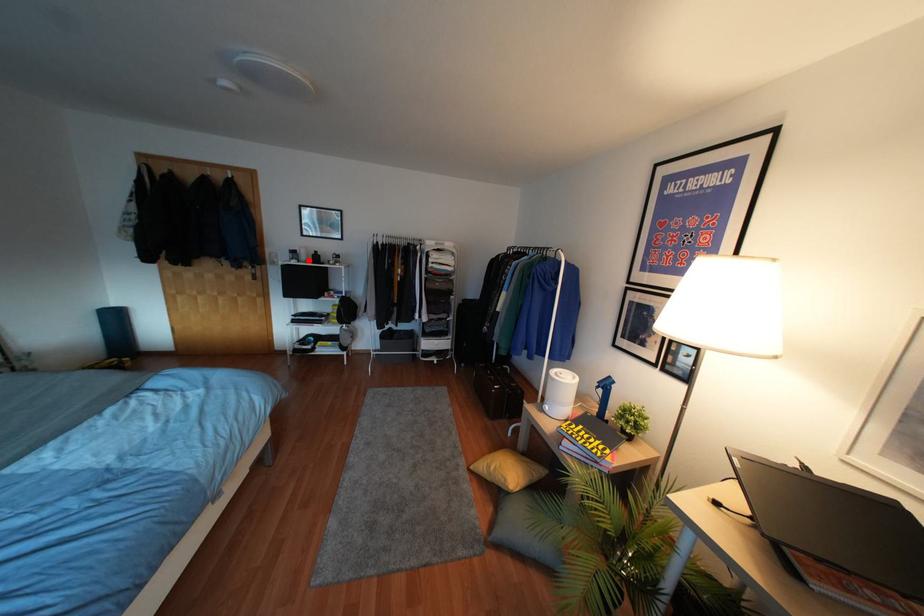
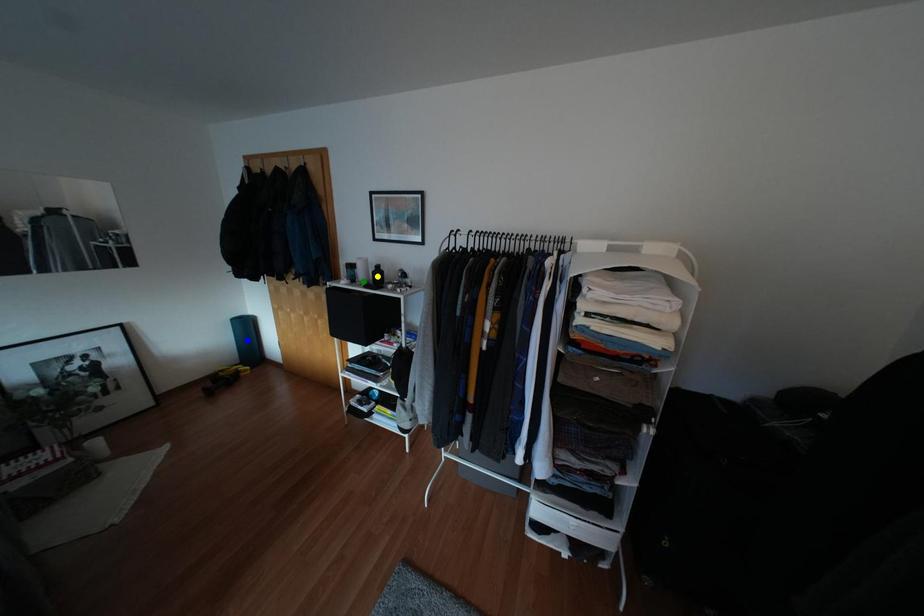
Question: I am providing you with two images of the same scene from different viewpoints. A red point is marked on the first image. You are given multiple points on the second image. Which point in image 2 is actually the same real-world point as the red point in image 1?

Choices:
 (A) yellow point
 (B) blue point
 (C) green point

Answer: (C)